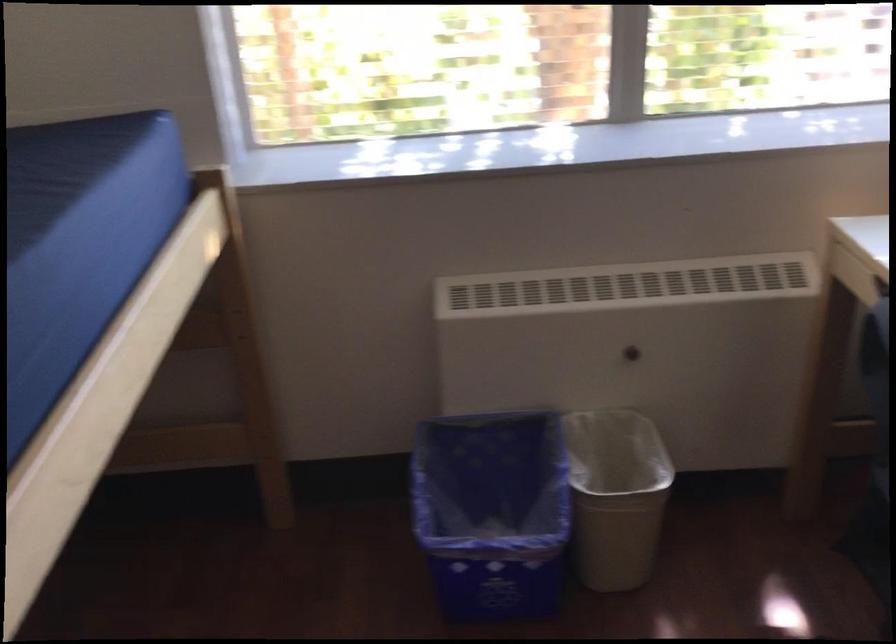
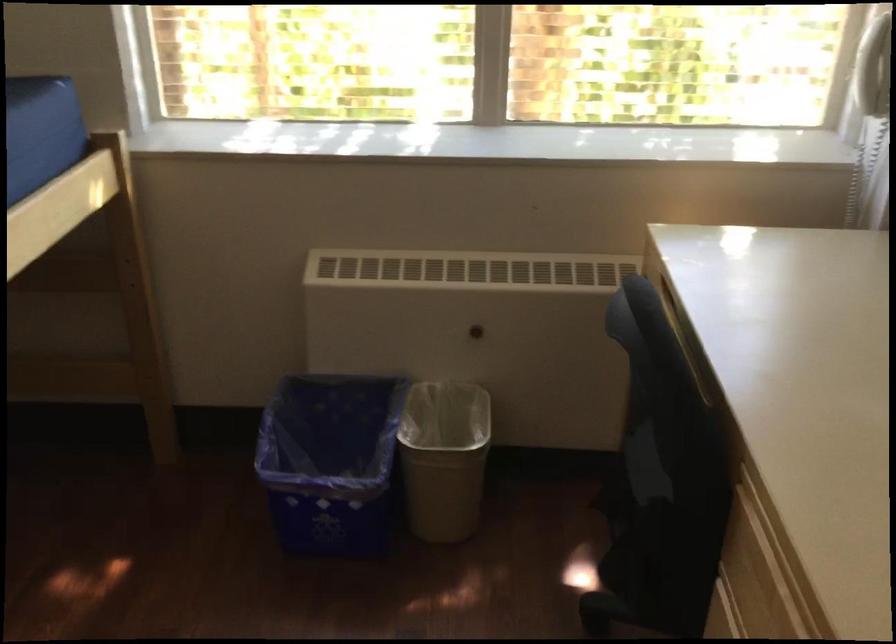
Question: Based on the continuous images, in which direction is the camera rotating? Reply with the corresponding letter.

Choices:
 (A) Left
 (B) Right
 (C) Up
 (D) Down

Answer: (A)